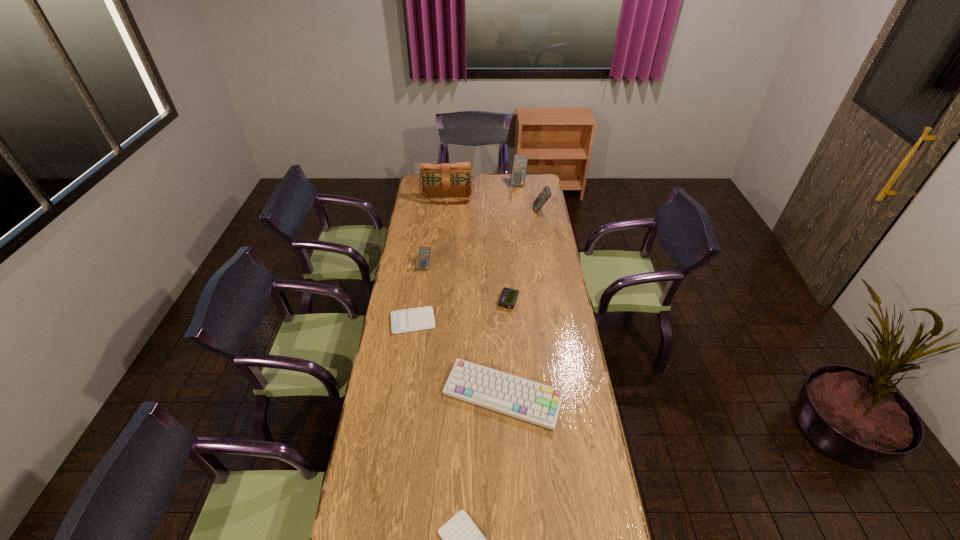
The image size is (960, 540). What are the coordinates of `the closest blue calculator to the sixth tallest object` in the screenshot? It's located at (424, 252).

At what (x,y) coordinates should I click in order to perform the action: click on white calculator identified as the closest to the third nearest calculator. Please return your answer as a coordinate pair (x, y). The height and width of the screenshot is (540, 960). Looking at the image, I should click on (422, 318).

Locate an element on the screen. The image size is (960, 540). blank area in the image that satisfies the following two spatial constraints: 1. on the front-facing side of the shoulder bag; 2. on the right side of the third shortest object is located at coordinates (439, 301).